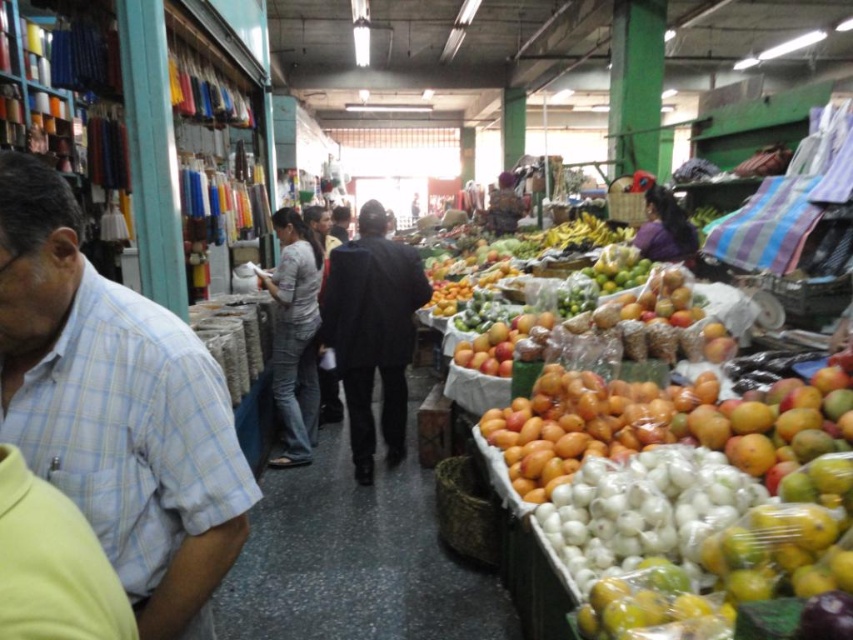
Can you confirm if white translucent onion at lower right is positioned to the left of yellow matte mangoes at center?

Incorrect, white translucent onion at lower right is not on the left side of yellow matte mangoes at center.

From the picture: Which is below, white translucent onion at lower right or yellow matte mangoes at center?

Positioned lower is yellow matte mangoes at center.

Is point (587, 577) farther from camera compared to point (531, 376)?

That is False.

Find the location of a particular element. white translucent onion at lower right is located at coordinates (643, 509).

Looking at this image, can you confirm if orange matte fruit at center is positioned below yellow matte mangoes at center?

No.

Can you confirm if orange matte fruit at center is positioned above yellow matte mangoes at center?

Yes, orange matte fruit at center is above yellow matte mangoes at center.

Is point (547, 428) farther from camera compared to point (438, 444)?

No.

Where is `orange matte fruit at center`? This screenshot has height=640, width=853. orange matte fruit at center is located at coordinates (587, 422).

Is black matte suit at center behind yellow matte mangoes at center?

Yes, it is behind yellow matte mangoes at center.

What do you see at coordinates (372, 332) in the screenshot? The height and width of the screenshot is (640, 853). I see `black matte suit at center` at bounding box center [372, 332].

This screenshot has height=640, width=853. What do you see at coordinates (372, 332) in the screenshot? I see `black matte suit at center` at bounding box center [372, 332].

Locate an element on the screen. black matte suit at center is located at coordinates (372, 332).